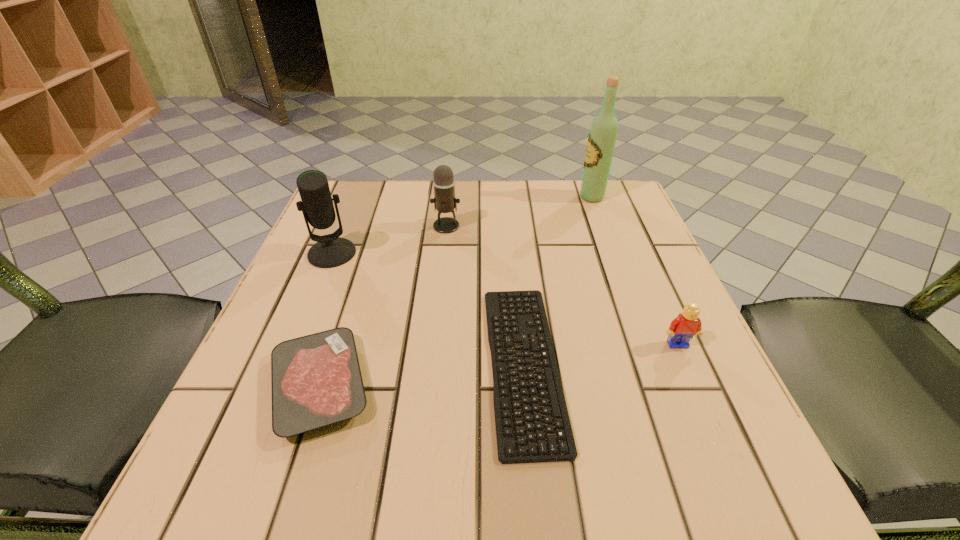
This screenshot has width=960, height=540. Find the location of `vacant space located 0.240m on the front-facing side of the farthest object`. vacant space located 0.240m on the front-facing side of the farthest object is located at coordinates (484, 197).

At what (x,y) coordinates should I click in order to perform the action: click on free location located on the front-facing side of the farthest object. Please return your answer as a coordinate pair (x, y). Looking at the image, I should click on (471, 197).

I want to click on vacant space located on the front-facing side of the farthest object, so click(x=488, y=197).

Locate an element on the screen. The image size is (960, 540). vacant space located 0.080m on the back of the nearer microphone is located at coordinates (346, 219).

In order to click on vacant space located 0.190m on the back of the third tallest object in this screenshot , I will do `click(451, 179)`.

Find the location of a particular element. The image size is (960, 540). vacant space situated on the front-facing side of the Lego is located at coordinates (693, 379).

You are a GUI agent. You are given a task and a screenshot of the screen. Output one action in this format:
    pyautogui.click(x=<x>, y=<y>)
    Task: Click on the vacant area situated on the back of the second shortest object
    The width and height of the screenshot is (960, 540).
    Given the screenshot: What is the action you would take?
    pyautogui.click(x=354, y=279)

Locate an element on the screen. This screenshot has width=960, height=540. vacant space positioned on the back of the computer keyboard is located at coordinates (511, 233).

The width and height of the screenshot is (960, 540). Find the location of `wine bottle located at the far edge`. wine bottle located at the far edge is located at coordinates (602, 137).

Image resolution: width=960 pixels, height=540 pixels. Identify the location of microphone positioned at the far edge. (444, 200).